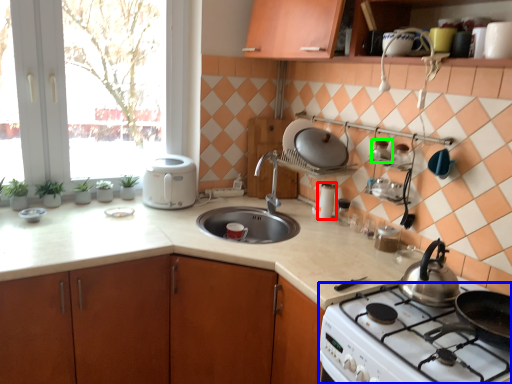
Question: Which object is positioned closest to kitchen appliance (highlighted by a red box)? Select from gas stove (highlighted by a blue box) and appliance (highlighted by a green box).

Choices:
 (A) gas stove
 (B) appliance

Answer: (B)